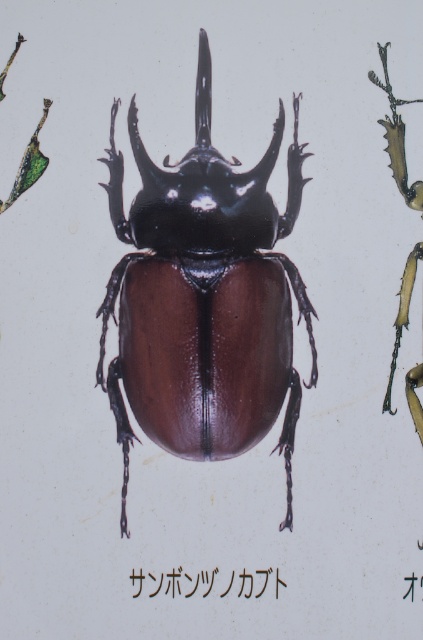
Question: Which point is farther from the camera taking this photo?

Choices:
 (A) (205, 595)
 (B) (268, 218)

Answer: (B)

Question: Is shiny brown beetle at center below black glossy beetle at center?

Choices:
 (A) no
 (B) yes

Answer: (A)

Question: Does shiny brown beetle at center have a smaller size compared to black glossy beetle at center?

Choices:
 (A) no
 (B) yes

Answer: (A)

Question: Is shiny brown beetle at center bigger than black glossy beetle at center?

Choices:
 (A) no
 (B) yes

Answer: (B)

Question: Which of the following is the farthest from the observer?

Choices:
 (A) black glossy beetle at center
 (B) shiny brown beetle at center

Answer: (A)